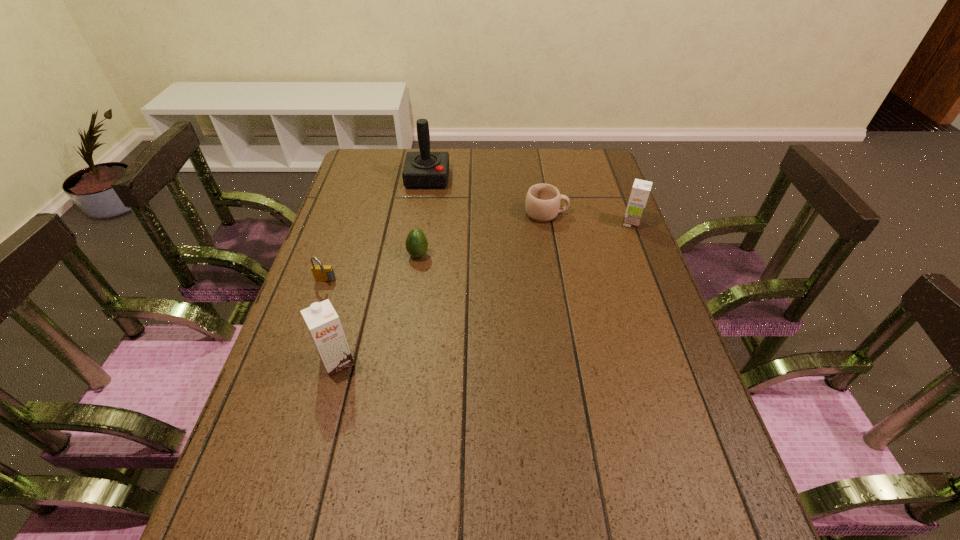
Find the location of a particular element. free space between the farther chocolate milk and the fifth object from left to right is located at coordinates (588, 219).

Locate an element on the screen. The image size is (960, 540). vacant space that is in between the joystick and the second object from right to left is located at coordinates (487, 196).

You are a GUI agent. You are given a task and a screenshot of the screen. Output one action in this format:
    pyautogui.click(x=<x>, y=<y>)
    Task: Click on the free space between the avocado and the leftmost object
    The image size is (960, 540).
    Given the screenshot: What is the action you would take?
    [x=372, y=268]

Find the location of a particular element. Image resolution: width=960 pixels, height=540 pixels. free space between the farther chocolate milk and the nearer chocolate milk is located at coordinates (485, 293).

Locate an element on the screen. The width and height of the screenshot is (960, 540). the second closest object relative to the taller chocolate milk is located at coordinates (416, 243).

Find the location of a particular element. object that ranks as the second closest to the padlock is located at coordinates (323, 323).

This screenshot has height=540, width=960. Find the location of `free space in the image that satisfies the following two spatial constraints: 1. on the side with the combination dials of the second nearest object; 2. on the right side of the left chocolate milk`. free space in the image that satisfies the following two spatial constraints: 1. on the side with the combination dials of the second nearest object; 2. on the right side of the left chocolate milk is located at coordinates (298, 362).

This screenshot has width=960, height=540. I want to click on vacant space that satisfies the following two spatial constraints: 1. on the side of the mug with the handle; 2. on the side with the combination dials of the second nearest object, so click(558, 282).